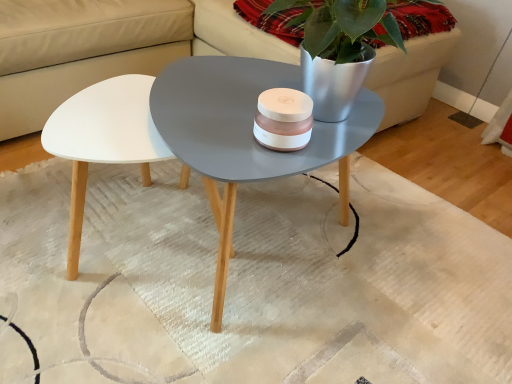
Question: From the image's perspective, is white textured rug at center below metallic silver pot at upper right?

Choices:
 (A) yes
 (B) no

Answer: (A)

Question: Is the depth of white textured rug at center greater than that of metallic silver pot at upper right?

Choices:
 (A) yes
 (B) no

Answer: (B)

Question: Considering the relative sizes of white textured rug at center and metallic silver pot at upper right in the image provided, is white textured rug at center thinner than metallic silver pot at upper right?

Choices:
 (A) no
 (B) yes

Answer: (A)

Question: Considering the relative sizes of white textured rug at center and metallic silver pot at upper right in the image provided, is white textured rug at center wider than metallic silver pot at upper right?

Choices:
 (A) no
 (B) yes

Answer: (B)

Question: Does white textured rug at center turn towards metallic silver pot at upper right?

Choices:
 (A) no
 (B) yes

Answer: (A)

Question: Is white textured rug at center turned away from metallic silver pot at upper right?

Choices:
 (A) no
 (B) yes

Answer: (A)

Question: Can you confirm if white leather couch at upper center is wider than white textured rug at center?

Choices:
 (A) yes
 (B) no

Answer: (A)

Question: From a real-world perspective, is white leather couch at upper center physically below white textured rug at center?

Choices:
 (A) no
 (B) yes

Answer: (A)

Question: From the image's perspective, is white leather couch at upper center on white textured rug at center?

Choices:
 (A) yes
 (B) no

Answer: (A)

Question: Does white leather couch at upper center lie behind white textured rug at center?

Choices:
 (A) no
 (B) yes

Answer: (B)

Question: Would you say white textured rug at center is part of white leather couch at upper center's contents?

Choices:
 (A) yes
 (B) no

Answer: (B)

Question: Is white leather couch at upper center turned away from white textured rug at center?

Choices:
 (A) yes
 (B) no

Answer: (B)

Question: Can you confirm if metallic silver pot at upper right is thinner than white leather couch at upper center?

Choices:
 (A) yes
 (B) no

Answer: (A)